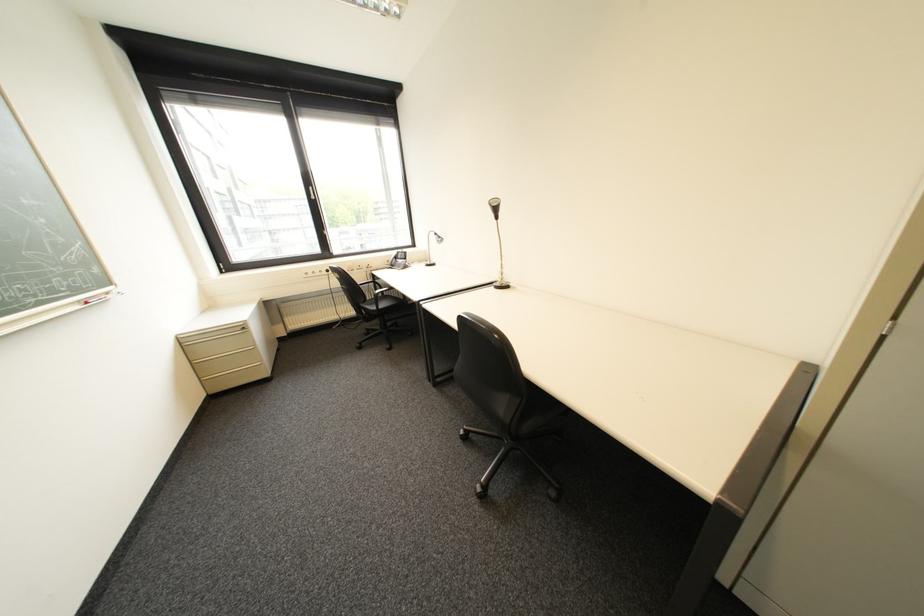
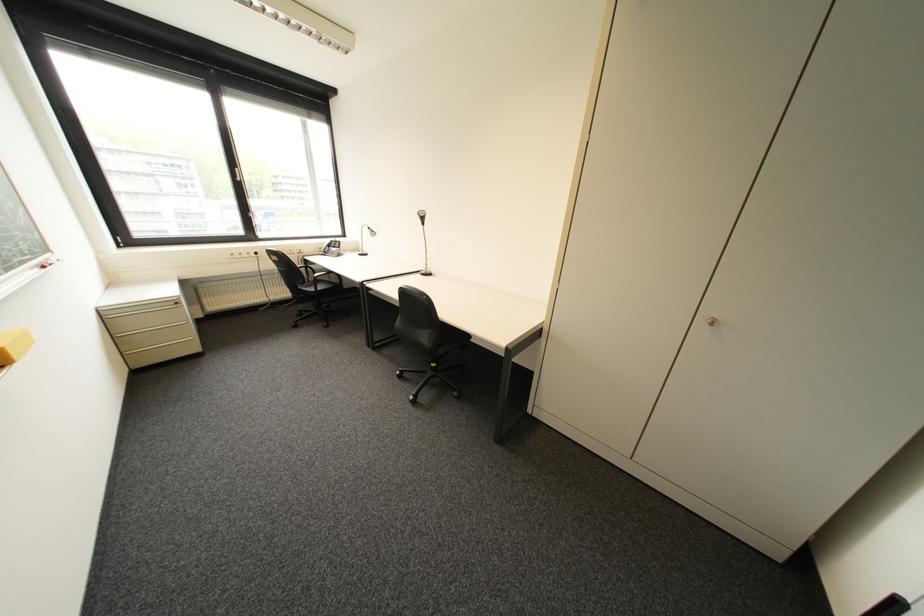
Question: I am providing you with two images of the same scene from different viewpoints. Please identify which objects are invisible in image2.

Choices:
 (A) silver desk lamp
 (B) silver cabinet knob
 (C) window handle
 (D) none of these

Answer: (D)